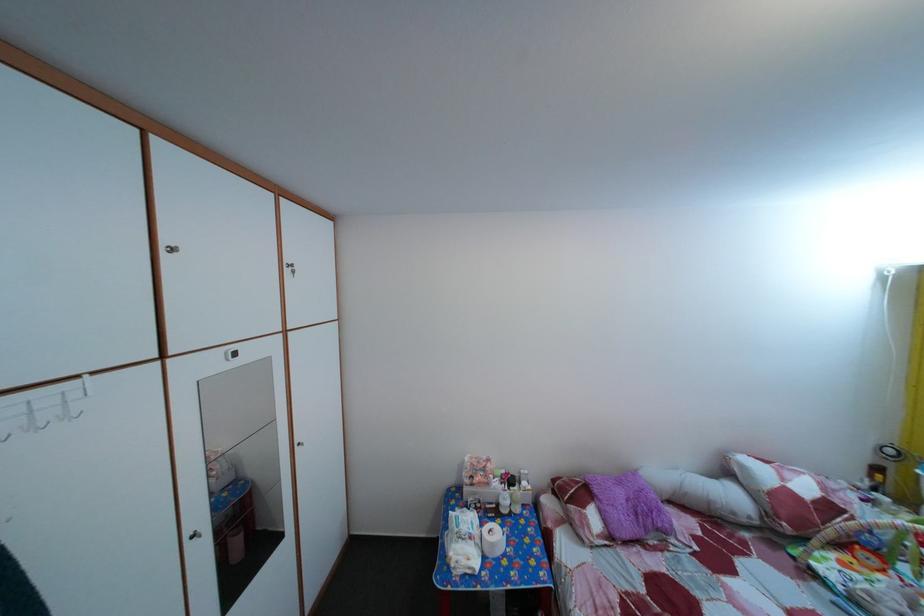
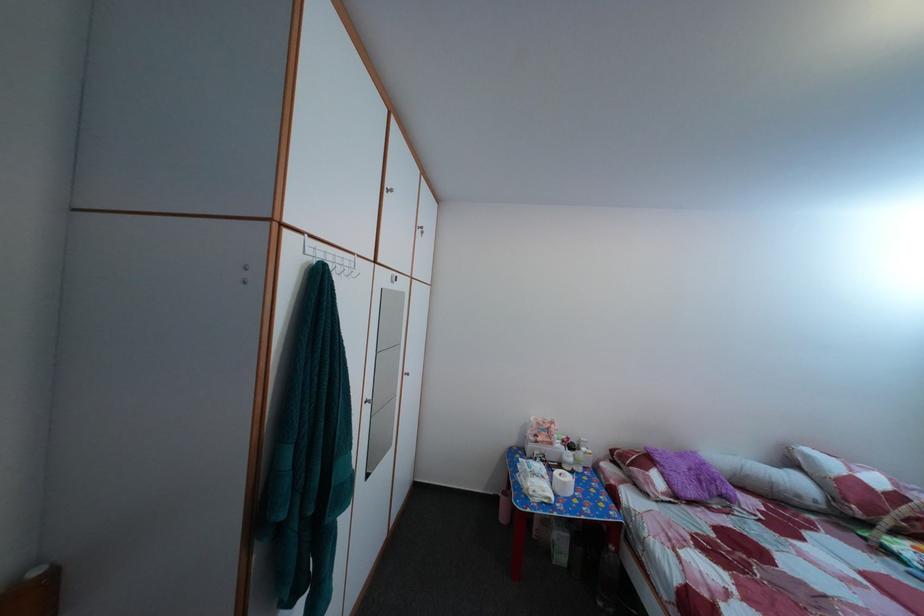
Locate, in the second image, the point that corresponds to pixel 744 522 in the first image.

(808, 504)